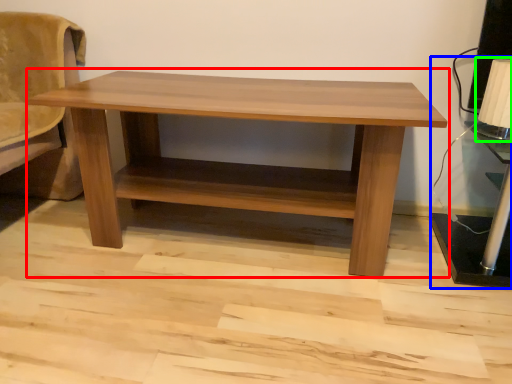
Question: Which object is positioned closest to table (highlighted by a red box)? Select from table lamp (highlighted by a blue box) and table lamp (highlighted by a green box).

Choices:
 (A) table lamp
 (B) table lamp

Answer: (A)